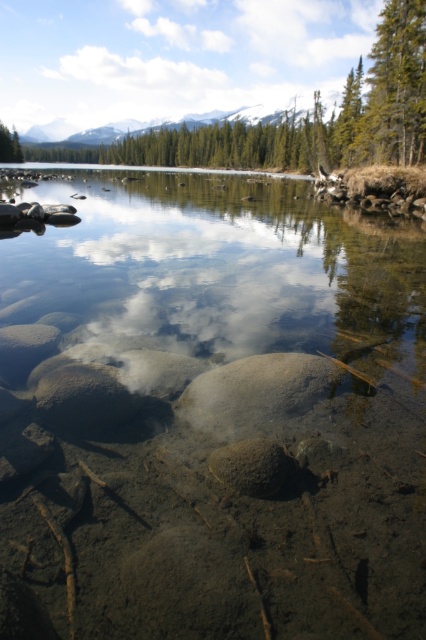
You are standing at the edge of the clear water at center and want to see the green textured tree at upper right. Is the tree visible above the water surface?

The clear water at center has a greater height compared to green textured tree at upper right, so the green textured tree at upper right is partially submerged and not fully visible above the water surface.

You are standing on the rocky shore and want to take a photo of the green textured tree at upper right and the clear water at center. Which object should you focus on first if you want to capture both in one shot?

You should focus on the green textured tree at upper right first because it is above the clear water at center, so adjusting focus from the tree downward will ensure both are in the frame.

You are a hiker who wants to cross the clear water at center to reach the green textured tree at upper right. The path is straight. Your backpack has a 100 feet rope. Do you have enough rope to reach the tree from the water?

The clear water at center is 80.36 feet from the green textured tree at upper right. Since your rope is 100 feet long, which is longer than the distance between them, you have enough rope to reach the green textured tree at upper right from the clear water at center.